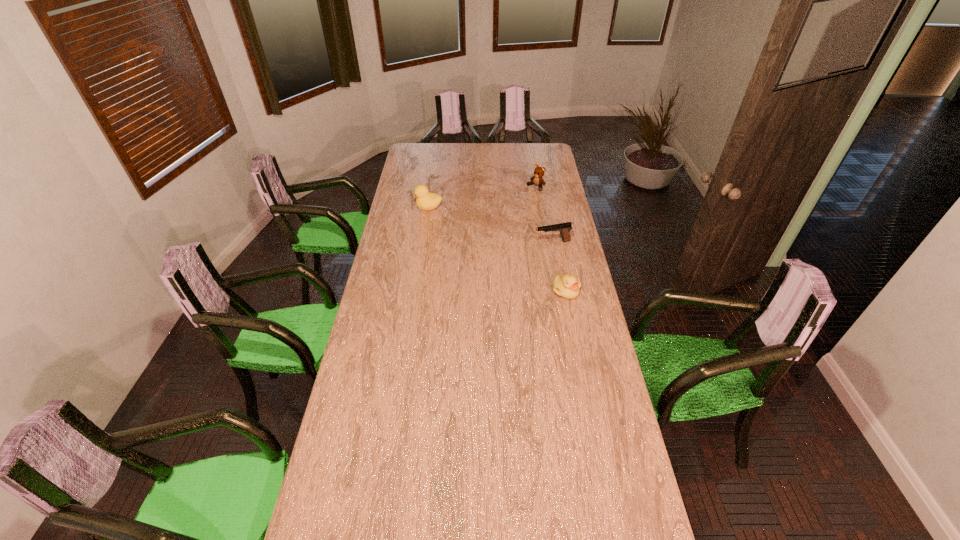
This screenshot has height=540, width=960. Identify the location of vacant area located 0.340m on the front-facing side of the farthest object. (492, 218).

The width and height of the screenshot is (960, 540). In order to click on vacant area located 0.270m at the muzzle of the second nearest object in this screenshot , I will do `click(480, 254)`.

This screenshot has height=540, width=960. I want to click on free space located 0.350m at the muzzle of the second nearest object, so click(464, 256).

Where is `free space located 0.210m at the muzzle of the second nearest object`? This screenshot has height=540, width=960. free space located 0.210m at the muzzle of the second nearest object is located at coordinates (492, 252).

Where is `object located at the left edge`? The width and height of the screenshot is (960, 540). object located at the left edge is located at coordinates (425, 200).

I want to click on duckling that is at the right edge, so click(568, 286).

What are the coordinates of `teddy bear that is at the right edge` in the screenshot? It's located at (537, 179).

The width and height of the screenshot is (960, 540). What are the coordinates of `pistol located in the right edge section of the desktop` in the screenshot? It's located at (564, 229).

This screenshot has width=960, height=540. Find the location of `vacant space at the far edge of the desktop`. vacant space at the far edge of the desktop is located at coordinates (508, 155).

Locate an element on the screen. vacant area at the near edge is located at coordinates (406, 481).